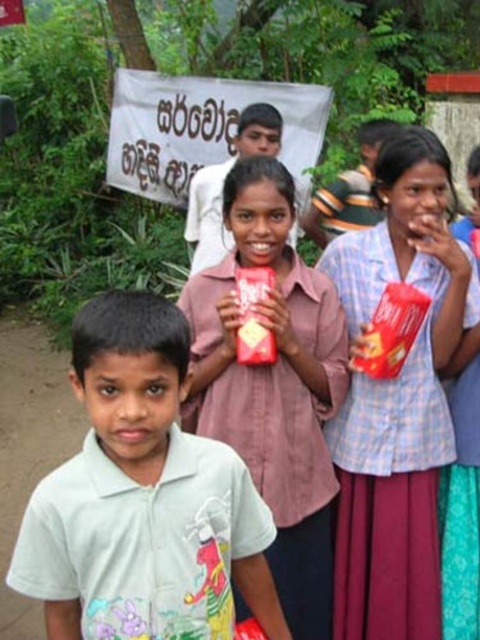
From the picture: Is light green cotton shirt at center taller than matte pink shirt at center?

In fact, light green cotton shirt at center may be shorter than matte pink shirt at center.

Does light green cotton shirt at center appear under matte pink shirt at center?

Correct, light green cotton shirt at center is located below matte pink shirt at center.

In order to click on light green cotton shirt at center in this screenshot , I will do `click(143, 499)`.

Where is `light green cotton shirt at center`? The image size is (480, 640). light green cotton shirt at center is located at coordinates (143, 499).

Is matte pink shirt at center further to camera compared to matte plastic cup at center?

No, it is in front of matte plastic cup at center.

I want to click on matte pink shirt at center, so click(x=274, y=385).

Between matte pink shirt at center and matte plastic boy at center, which one appears on the left side from the viewer's perspective?

matte pink shirt at center

Is matte pink shirt at center below matte plastic boy at center?

Yes, matte pink shirt at center is below matte plastic boy at center.

Identify the location of matte pink shirt at center. (274, 385).

Where is `matte pink shirt at center`? This screenshot has height=640, width=480. matte pink shirt at center is located at coordinates (274, 385).